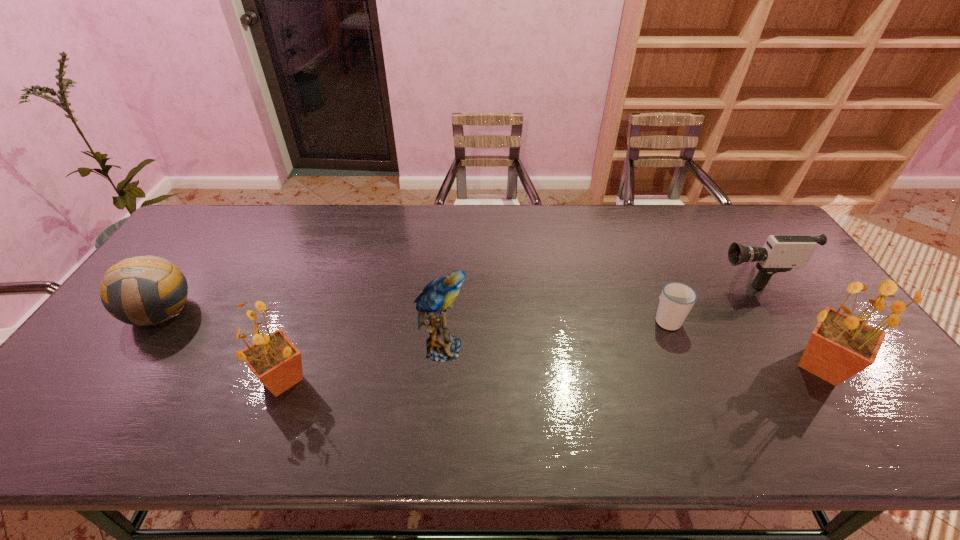
The width and height of the screenshot is (960, 540). What are the coordinates of `free region located at the front of the shorter sunflower with flowers visible` in the screenshot? It's located at (101, 379).

Where is `free space located 0.050m at the front of the taller sunflower with flowers visible`? The image size is (960, 540). free space located 0.050m at the front of the taller sunflower with flowers visible is located at coordinates (876, 366).

Identify the location of free location located with a handle on the side of the fourth object from left to right. The height and width of the screenshot is (540, 960). (635, 240).

Locate an element on the screen. free space located 0.400m with a handle on the side of the fourth object from left to right is located at coordinates (627, 222).

Image resolution: width=960 pixels, height=540 pixels. Identify the location of blank space located 0.090m with a handle on the side of the fourth object from left to right. (653, 284).

At what (x,y) coordinates should I click in order to perform the action: click on free spot located 0.190m on the face of the parrot. Please return your answer as a coordinate pair (x, y). This screenshot has width=960, height=540. Looking at the image, I should click on (541, 348).

You are a GUI agent. You are given a task and a screenshot of the screen. Output one action in this format:
    pyautogui.click(x=<x>, y=<y>)
    Task: Click on the vacant point located 0.070m on the back of the volleyball
    This screenshot has width=960, height=540.
    Given the screenshot: What is the action you would take?
    pyautogui.click(x=188, y=272)

Locate an element on the screen. free space located on the recording direction of the camcorder is located at coordinates (662, 274).

This screenshot has width=960, height=540. Find the location of `vacant space located 0.140m on the recording direction of the camcorder`. vacant space located 0.140m on the recording direction of the camcorder is located at coordinates (666, 274).

Locate an element on the screen. The image size is (960, 540). vacant space located 0.090m on the recording direction of the camcorder is located at coordinates (683, 274).